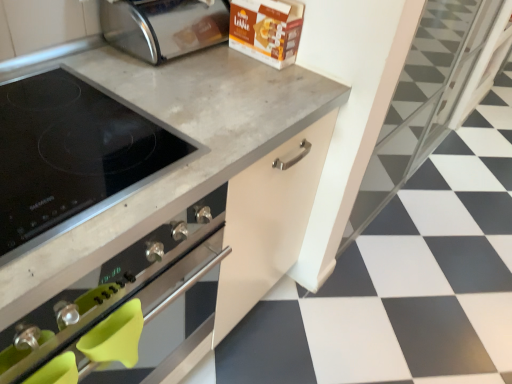
Question: Would you say white glossy tile at center is to the left or to the right of black matte stovetop at center in the picture?

Choices:
 (A) left
 (B) right

Answer: (B)

Question: From the image's perspective, is white glossy tile at center positioned above or below black matte stovetop at center?

Choices:
 (A) below
 (B) above

Answer: (B)

Question: Estimate the real-world distances between objects in this image. Which object is farther from the polished stainless steel toaster at upper center?

Choices:
 (A) black glass cooktop at upper left
 (B) black matte stovetop at center
 (C) white glossy tile at center

Answer: (C)

Question: Which object is the closest to the polished stainless steel toaster at upper center?

Choices:
 (A) white glossy tile at center
 (B) black glass cooktop at upper left
 (C) black matte stovetop at center

Answer: (C)